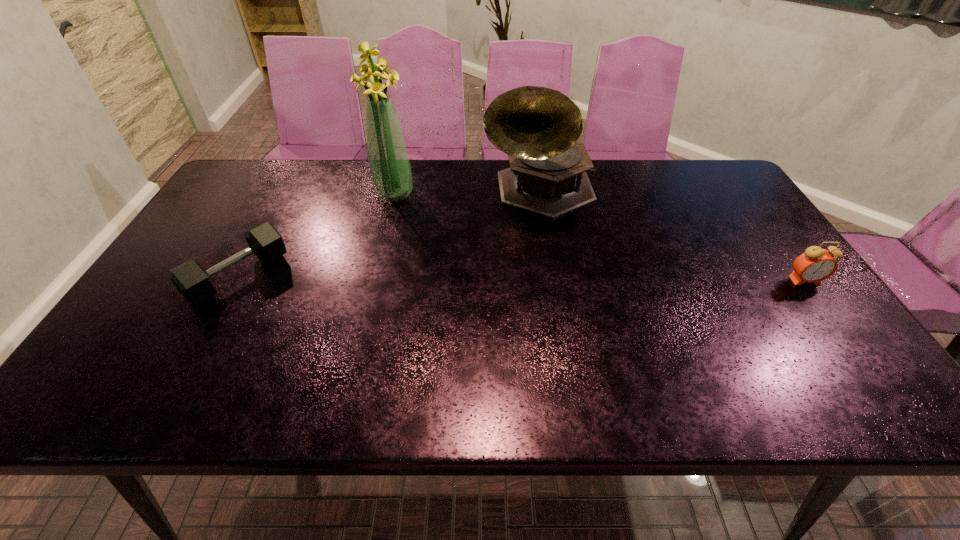
You are a GUI agent. You are given a task and a screenshot of the screen. Output one action in this format:
    pyautogui.click(x=<x>, y=<y>)
    Task: Click on the free spot on the desktop that is between the dumbbell and the alarm clock and is positioned on the front-facing side of the bouquet
    Image resolution: width=960 pixels, height=540 pixels.
    Given the screenshot: What is the action you would take?
    pyautogui.click(x=535, y=279)

You are a GUI agent. You are given a task and a screenshot of the screen. Output one action in this format:
    pyautogui.click(x=<x>, y=<y>)
    Task: Click on the free space on the desktop that is between the leftmost object and the rightmost object and is positioned on the horn direction of the phonograph record
    This screenshot has height=540, width=960.
    Given the screenshot: What is the action you would take?
    pyautogui.click(x=561, y=279)